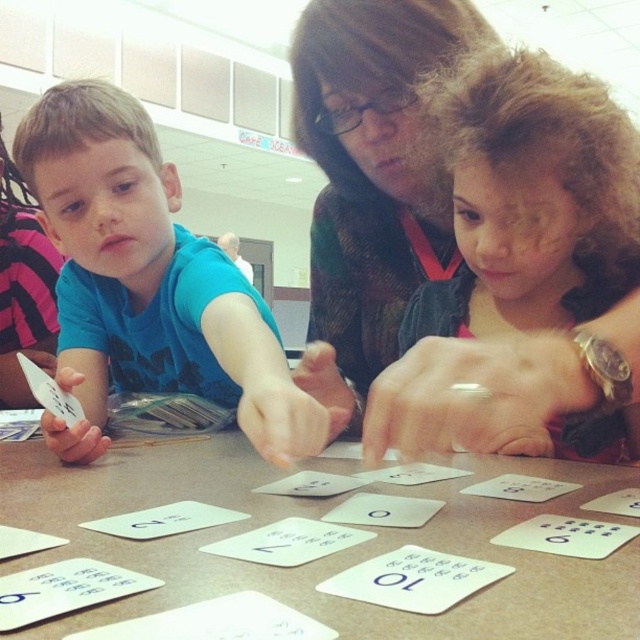
Question: Which object is the closest to the white paper cards at center?

Choices:
 (A) curly brown hair at upper right
 (B) matte blue shirt at left

Answer: (B)

Question: Which object is positioned farthest from the matte blue shirt at left?

Choices:
 (A) curly brown hair at upper right
 (B) white paper cards at center

Answer: (A)

Question: Is white paper cards at center bigger than matte blue shirt at left?

Choices:
 (A) no
 (B) yes

Answer: (A)

Question: From the image, what is the correct spatial relationship of curly brown hair at upper right in relation to matte blue shirt at left?

Choices:
 (A) right
 (B) left

Answer: (A)

Question: Is white paper cards at center to the left of curly brown hair at upper right from the viewer's perspective?

Choices:
 (A) yes
 (B) no

Answer: (A)

Question: Which object appears closest to the camera in this image?

Choices:
 (A) white paper cards at center
 (B) curly brown hair at upper right
 (C) matte blue shirt at left

Answer: (A)